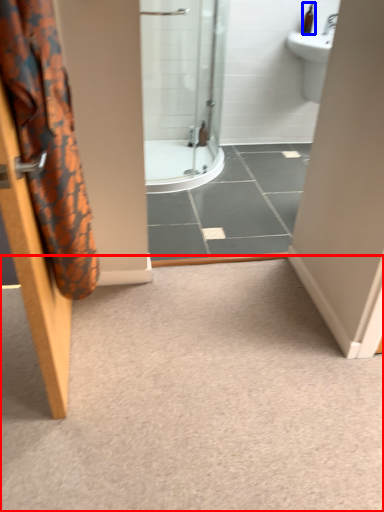
Question: Among these objects, which one is farthest to the camera, plain (highlighted by a red box) or toiletry (highlighted by a blue box)?

Choices:
 (A) plain
 (B) toiletry

Answer: (B)